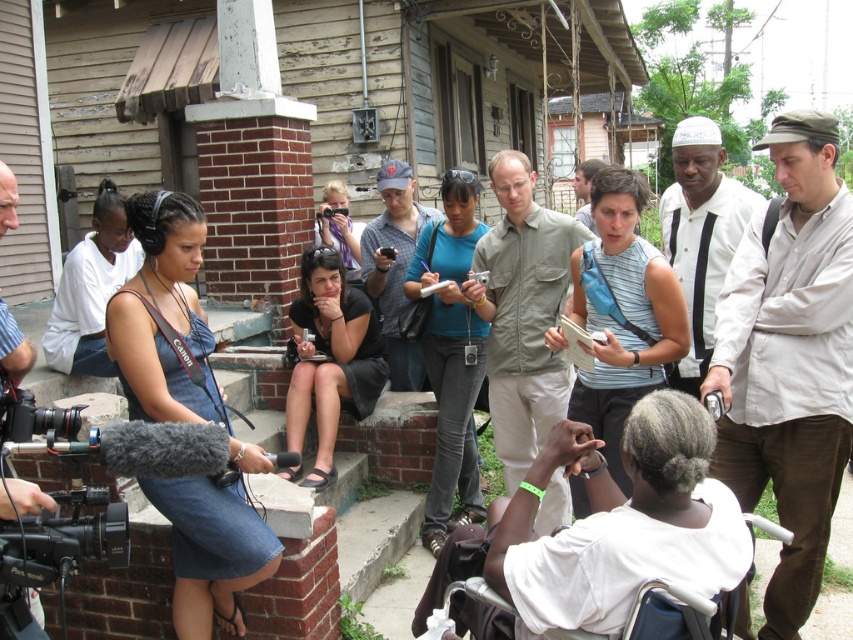
Question: Which point is farther to the camera?

Choices:
 (A) (13, 227)
 (B) (784, 410)

Answer: (B)

Question: Does khaki cotton shirt at center have a lesser width compared to black plastic video camera at lower left?

Choices:
 (A) no
 (B) yes

Answer: (B)

Question: Which object is farther from the camera taking this photo?

Choices:
 (A) matte gray cap at center
 (B) light beige shirt at center
 (C) white matte shirt at center-right

Answer: (A)

Question: Is white matte shirt at center-right wider than striped cotton shirt at left?

Choices:
 (A) yes
 (B) no

Answer: (A)

Question: Can you confirm if white matte shirt at center-right is thinner than striped cotton shirt at left?

Choices:
 (A) yes
 (B) no

Answer: (B)

Question: Which object is farther from the camera taking this photo?

Choices:
 (A) matte gray cap at center
 (B) light beige shirt at center
 (C) black fabric skirt at center
 (D) striped cotton shirt at left

Answer: (A)